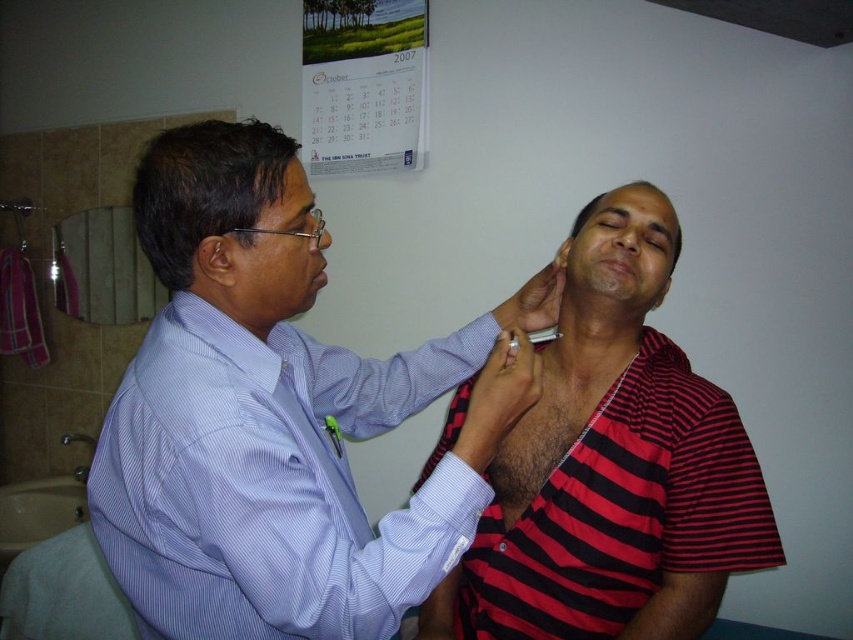
From the picture: You are a patient in the clinic and need to locate two specific points on your chart. The first point is at coordinates point (204, 269) and the second is at point (648, 307). From your perspective facing the chart, which point is closer to you?

Point (204, 269) is in front of point (648, 307), so it is closer to you.

You are a patient in a clinic and you see a doctor wearing a blue striped shirt at upper left and a nurse wearing a red striped shirt at center. Which medical professional is wearing a larger shirt?

The blue striped shirt at upper left has a larger size compared to the red striped shirt at center, so the doctor wearing the blue striped shirt at upper left has a larger shirt.

Based on the photo, you are a patient in a clinic and need to identify the doctor. The doctor is wearing a blue striped shirt at upper left and a red striped shirt at center. Which one is the doctor based on their position?

The doctor is the blue striped shirt at upper left because they are positioned above the red striped shirt at center, which is typical for medical professionals in such settings.